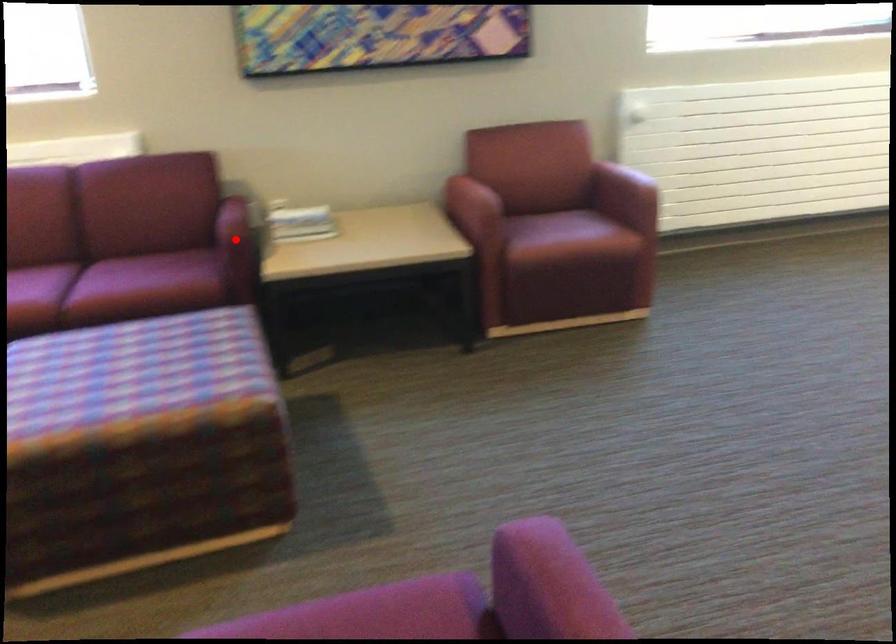
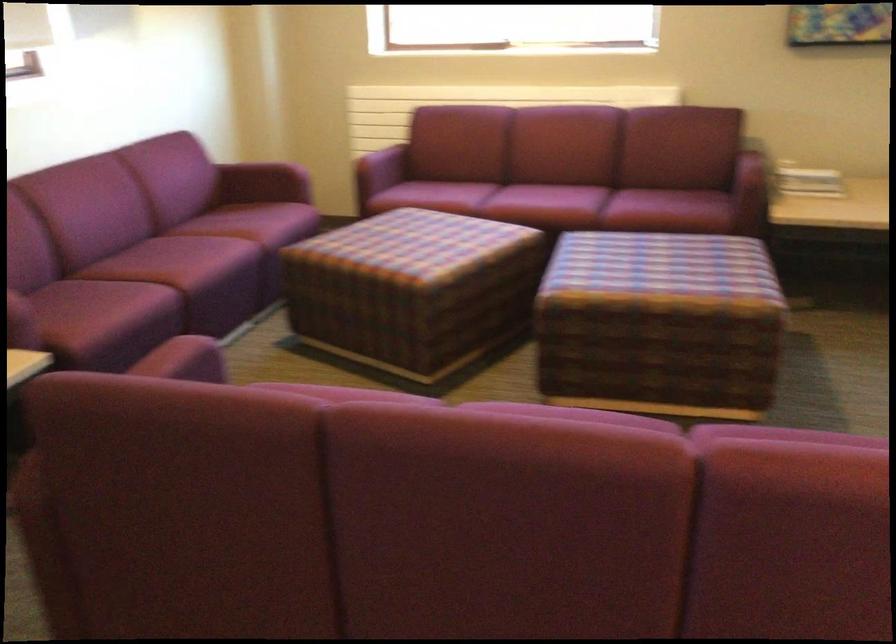
Question: I am providing you with two images of the same scene from different viewpoints. A red point is shown in image1. For the corresponding object point in image2, is it positioned nearer or farther from the camera?

Choices:
 (A) Nearer
 (B) Farther

Answer: (B)